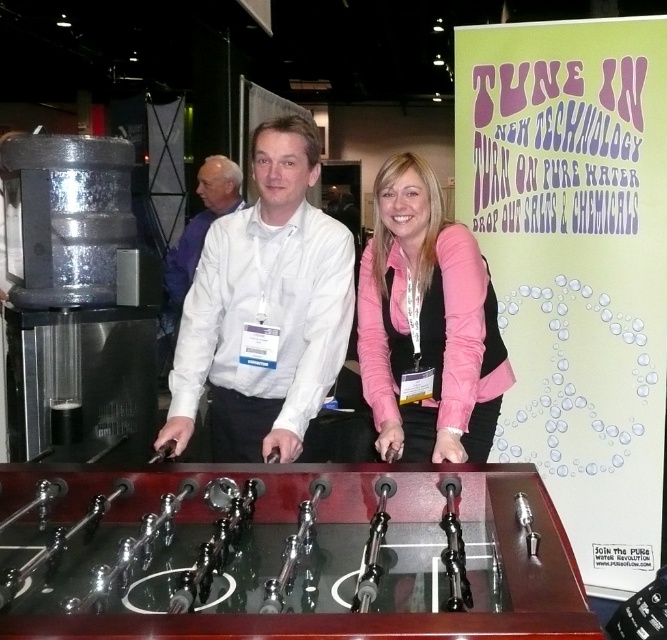
Question: Is white glossy shirt at center above pink fabric shirt at center?

Choices:
 (A) no
 (B) yes

Answer: (B)

Question: Which point is farther to the camera?

Choices:
 (A) pink fabric shirt at center
 (B) white matte shirt at center
 (C) white glossy shirt at center
 (D) shiny brown wooden foosball table at center

Answer: (B)

Question: Which point is farther from the camera taking this photo?

Choices:
 (A) (165, 312)
 (B) (293, 442)
 (C) (470, 356)

Answer: (A)

Question: In this image, where is shiny brown wooden foosball table at center located relative to white glossy shirt at center?

Choices:
 (A) right
 (B) left

Answer: (A)

Question: Which object is closer to the camera taking this photo?

Choices:
 (A) shiny brown wooden foosball table at center
 (B) white glossy shirt at center

Answer: (A)

Question: Does shiny brown wooden foosball table at center have a lesser width compared to white matte shirt at center?

Choices:
 (A) yes
 (B) no

Answer: (B)